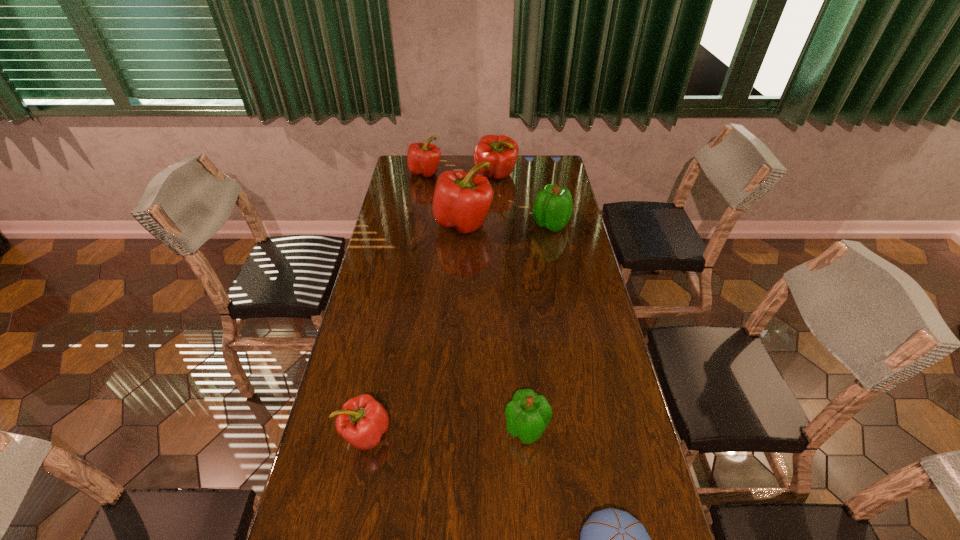
Find the location of `empty space between the third farthest pink bell pepper and the nearest pink bell pepper`. empty space between the third farthest pink bell pepper and the nearest pink bell pepper is located at coordinates (415, 329).

The width and height of the screenshot is (960, 540). In order to click on free space between the smaller green bell pepper and the biggest pink bell pepper in this screenshot , I will do 495,326.

At what (x,y) coordinates should I click in order to perform the action: click on object identified as the sixth closest to the tallest bell pepper. Please return your answer as a coordinate pair (x, y). The width and height of the screenshot is (960, 540). Looking at the image, I should click on (611, 539).

The height and width of the screenshot is (540, 960). In order to click on object that is the second nearest to the smallest pink bell pepper in this screenshot , I will do `click(611, 539)`.

Locate an element on the screen. bell pepper that is the second closest one to the nearest pink bell pepper is located at coordinates (461, 200).

Point out which bell pepper is positioned as the fourth nearest to the second biggest pink bell pepper. Please provide its 2D coordinates. Your answer should be formatted as a tuple, i.e. [(x, y)], where the tuple contains the x and y coordinates of a point satisfying the conditions above.

[(528, 414)]

This screenshot has width=960, height=540. I want to click on the fourth closest pink bell pepper to the rightmost bell pepper, so click(362, 421).

Identify which pink bell pepper is located as the second nearest to the farther green bell pepper. Please provide its 2D coordinates. Your answer should be formatted as a tuple, i.e. [(x, y)], where the tuple contains the x and y coordinates of a point satisfying the conditions above.

[(501, 151)]